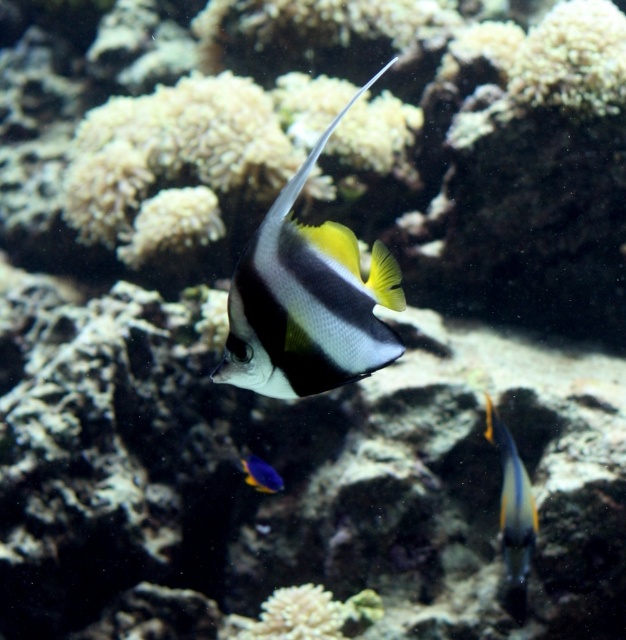
You are a scuba diver observing an underwater scene. You notice two points marked in the image. From your perspective, which point is closer to you, point (x=511, y=570) or point (x=250, y=454)?

Point (x=511, y=570) is in front of point (x=250, y=454), so it is closer to you.

You are a marine biologist observing this underwater scene. You notice the black and white striped fish at center and the white coral at center. Which object is closer to you, the observer?

The black and white striped fish at center is closer to you because it is positioned in front of the white coral at center.

You are a marine biologist observing an underwater scene. You notice two fish, the shiny blue and yellow fish at center and the shiny blue fish at lower center. Which fish is located above the other?

The shiny blue and yellow fish at center is positioned over the shiny blue fish at lower center, meaning it is above the other fish.